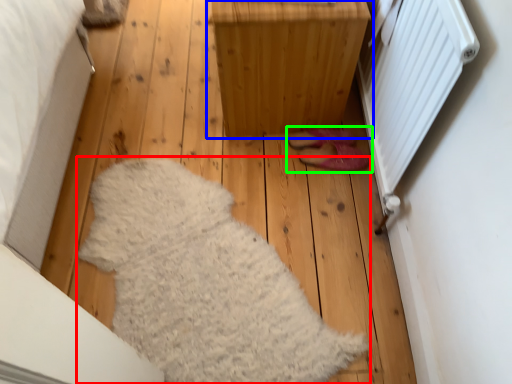
Question: Estimate the real-world distances between objects in this image. Which object is farther from blanket (highlighted by a red box), furniture (highlighted by a blue box) or footwear (highlighted by a green box)?

Choices:
 (A) furniture
 (B) footwear

Answer: (B)